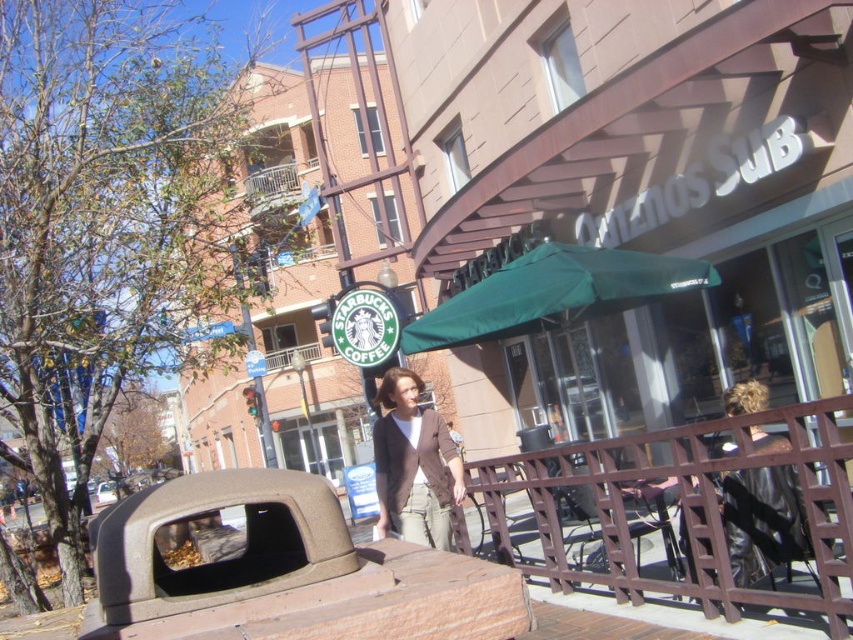
Question: Is the position of green fabric umbrella at center more distant than that of shiny black jacket at upper right?

Choices:
 (A) no
 (B) yes

Answer: (B)

Question: Which object is farther from the camera taking this photo?

Choices:
 (A) khaki cotton pants at center
 (B) shiny black jacket at upper right
 (C) green fabric umbrella at center

Answer: (C)

Question: Does green fabric umbrella at center lie in front of shiny black jacket at upper right?

Choices:
 (A) no
 (B) yes

Answer: (A)

Question: Which object is the closest to the green fabric umbrella at center?

Choices:
 (A) khaki cotton pants at center
 (B) shiny black jacket at upper right

Answer: (B)

Question: Is green fabric umbrella at center bigger than khaki cotton pants at center?

Choices:
 (A) no
 (B) yes

Answer: (B)

Question: Which point is closer to the camera taking this photo?

Choices:
 (A) (766, 472)
 (B) (454, 493)
 (C) (440, 320)

Answer: (A)